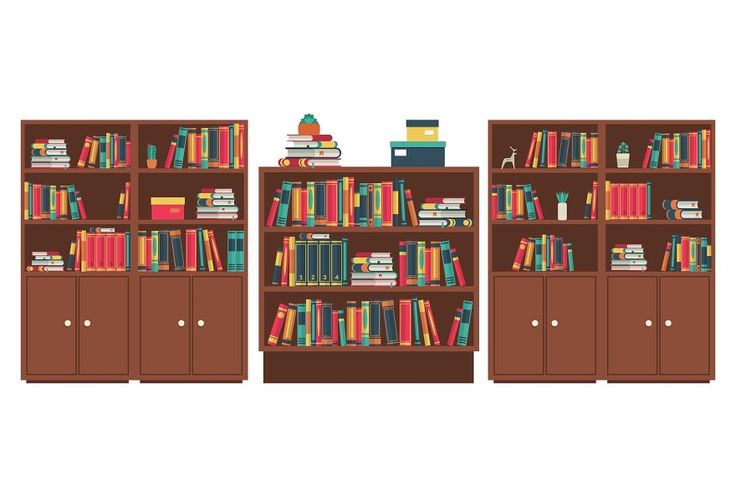
Image resolution: width=736 pixels, height=490 pixels. Identify the location of cabinet knobs. (66, 324), (85, 323), (177, 324), (202, 324), (533, 320), (552, 321), (648, 321), (668, 319).